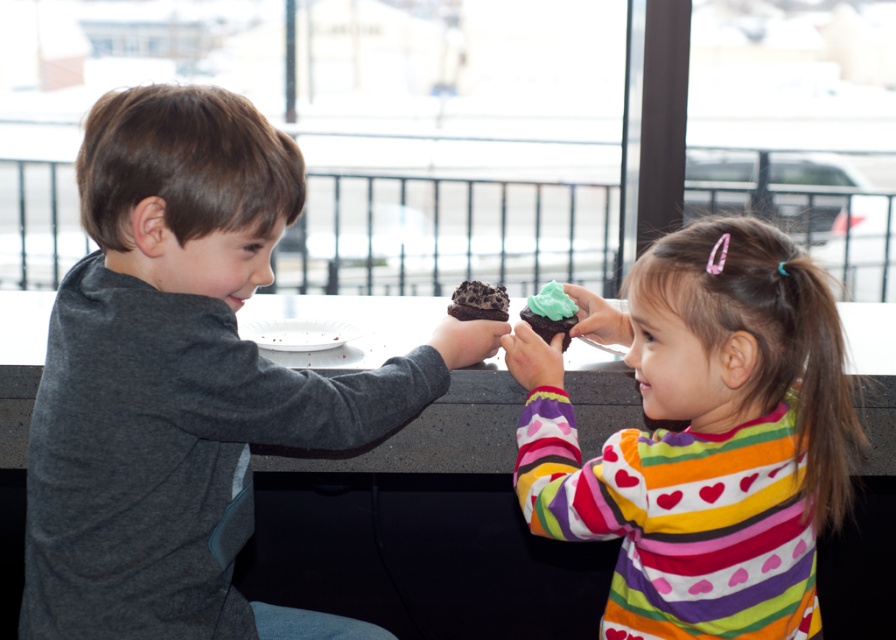
Consider the image. You are a photographer trying to capture a closeup of the green frosting cupcake at center. However, you notice the pastel striped shirt at center is blocking your view. Based on their positions, can you determine if you can adjust your angle to take the photo without moving any objects?

The pastel striped shirt at center is closer to the viewer than the green frosting cupcake at center. Therefore, adjusting your angle slightly might allow you to take the photo by positioning the camera around the shirt to capture the cupcake behind it.

You are a photographer trying to capture a closeup of the green frosting cupcake at center without including the dark gray shirt at left in the frame. Based on their positions, is this possible?

The dark gray shirt at left is positioned on the left side of the green frosting cupcake at center, so if you move the camera to the right side of the cupcake, you can avoid including the dark gray shirt at left in the frame.

You are a photographer trying to capture a photo of the two children. You notice the dark gray shirt at left and the pastel striped shirt at center. Which shirt should you focus on to ensure it appears larger in the photo?

The dark gray shirt at left has a greater height compared to the pastel striped shirt at center, so focusing on it will make it appear larger in the photo.